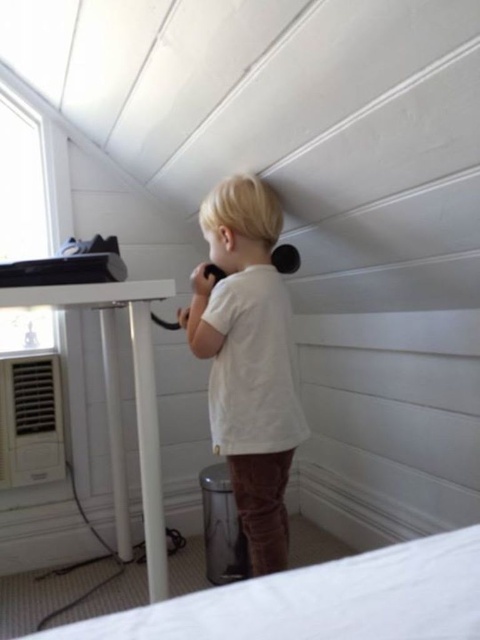
Question: Is white cotton shirt at center smaller than white fabric bed at lower center?

Choices:
 (A) yes
 (B) no

Answer: (B)

Question: Does white cotton shirt at center have a smaller size compared to white fabric bed at lower center?

Choices:
 (A) no
 (B) yes

Answer: (A)

Question: Can you confirm if white cotton shirt at center is positioned to the left of white fabric bed at lower center?

Choices:
 (A) yes
 (B) no

Answer: (A)

Question: Which point is farther to the camera?

Choices:
 (A) white cotton shirt at center
 (B) white fabric bed at lower center

Answer: (A)

Question: Which of the following is the farthest from the observer?

Choices:
 (A) white fabric bed at lower center
 (B) white cotton shirt at center

Answer: (B)